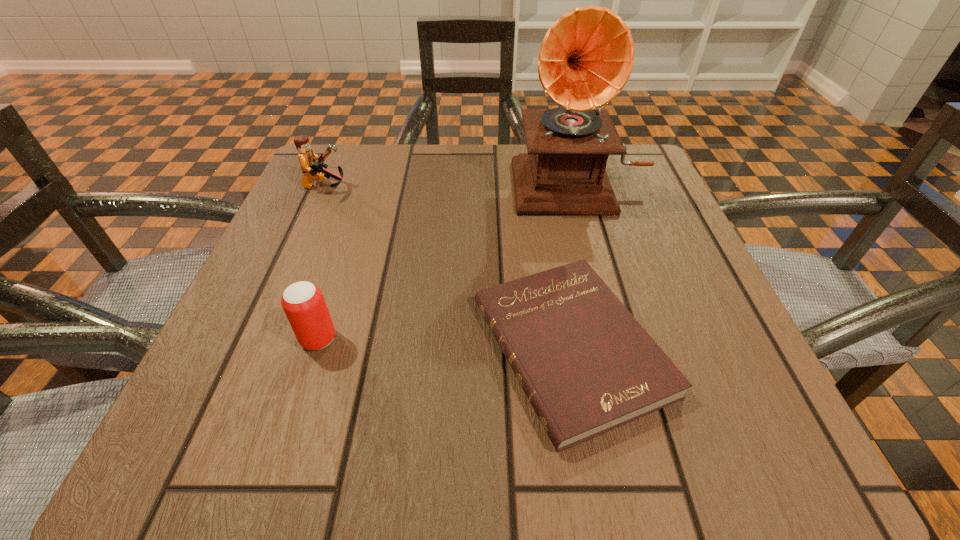
Where is `free location that satisfies the following two spatial constraints: 1. on the back side of the beer can; 2. holding a crossbow in the hands of the leftmost object`? Image resolution: width=960 pixels, height=540 pixels. free location that satisfies the following two spatial constraints: 1. on the back side of the beer can; 2. holding a crossbow in the hands of the leftmost object is located at coordinates (367, 187).

Where is `vacant space that satisfies the following two spatial constraints: 1. on the back side of the shortest object; 2. holding a crossbow in the hands of the Lego`? vacant space that satisfies the following two spatial constraints: 1. on the back side of the shortest object; 2. holding a crossbow in the hands of the Lego is located at coordinates (542, 187).

Where is `vacant point that satisfies the following two spatial constraints: 1. holding a crossbow in the hands of the Lego; 2. on the right side of the hardback book`? The width and height of the screenshot is (960, 540). vacant point that satisfies the following two spatial constraints: 1. holding a crossbow in the hands of the Lego; 2. on the right side of the hardback book is located at coordinates (255, 348).

The height and width of the screenshot is (540, 960). Find the location of `free location that satisfies the following two spatial constraints: 1. holding a crossbow in the hands of the beer can; 2. on the right side of the Lego`. free location that satisfies the following two spatial constraints: 1. holding a crossbow in the hands of the beer can; 2. on the right side of the Lego is located at coordinates (259, 339).

Locate an element on the screen. The width and height of the screenshot is (960, 540). free space in the image that satisfies the following two spatial constraints: 1. on the horn of the phonograph record; 2. holding a crossbow in the hands of the leftmost object is located at coordinates (580, 187).

You are a GUI agent. You are given a task and a screenshot of the screen. Output one action in this format:
    pyautogui.click(x=<x>, y=<y>)
    Task: Click on the free spot that satisfies the following two spatial constraints: 1. on the horn of the phonograph record; 2. holding a crossbow in the hands of the leftmost object
    
    Given the screenshot: What is the action you would take?
    pyautogui.click(x=580, y=187)

Locate an element on the screen. This screenshot has width=960, height=540. vacant space that satisfies the following two spatial constraints: 1. holding a crossbow in the hands of the leftmost object; 2. on the back side of the hardback book is located at coordinates (255, 348).